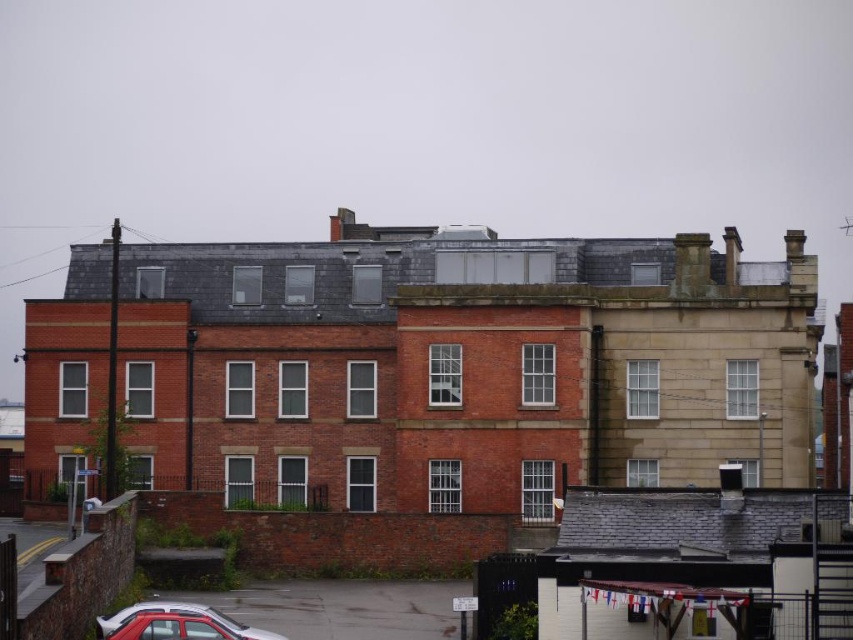
Question: Among these points, which one is nearest to the camera?

Choices:
 (A) (718, 602)
 (B) (233, 621)

Answer: (A)

Question: From the image, what is the correct spatial relationship of brightly colored fabric at lower right in relation to metallic silver car at lower left?

Choices:
 (A) right
 (B) left

Answer: (A)

Question: Observing the image, what is the correct spatial positioning of brightly colored fabric at lower right in reference to metallic silver car at lower left?

Choices:
 (A) above
 (B) below

Answer: (A)

Question: Is brightly colored fabric at lower right to the left of metallic silver car at lower left from the viewer's perspective?

Choices:
 (A) no
 (B) yes

Answer: (A)